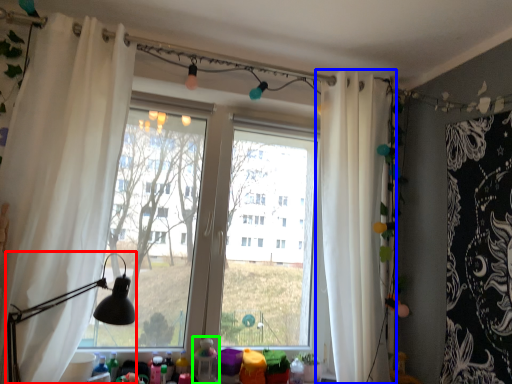
Question: Considering the real-world distances, which object is closest to table lamp (highlighted by a red box)? curtain (highlighted by a blue box) or toy (highlighted by a green box).

Choices:
 (A) curtain
 (B) toy

Answer: (B)